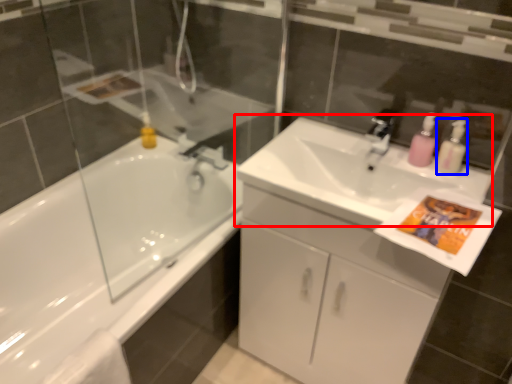
Question: Which object appears farthest to the camera in this image, sink (highlighted by a red box) or cleaning product (highlighted by a blue box)?

Choices:
 (A) sink
 (B) cleaning product

Answer: (B)